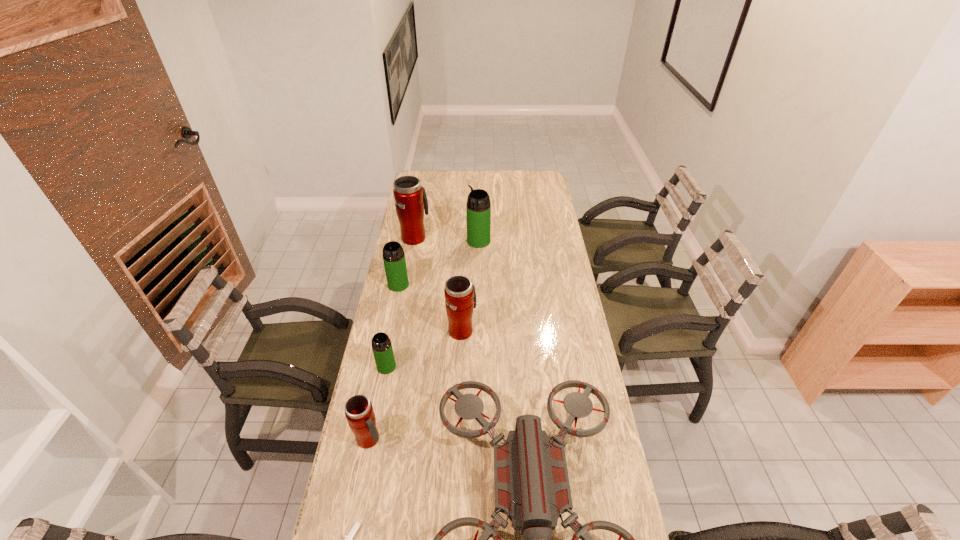
Where is `the farthest green thermos bottle`? the farthest green thermos bottle is located at coordinates (478, 208).

Find the location of a particular element. the rightmost green thermos bottle is located at coordinates (478, 208).

At what (x,y) coordinates should I click in order to perform the action: click on the biggest red thermos bottle. Please return your answer as a coordinate pair (x, y). This screenshot has width=960, height=540. Looking at the image, I should click on (410, 197).

This screenshot has width=960, height=540. I want to click on the second biggest green thermos bottle, so click(394, 260).

Locate an element on the screen. The width and height of the screenshot is (960, 540). the third farthest thermos bottle is located at coordinates (394, 260).

The height and width of the screenshot is (540, 960). I want to click on the rightmost red thermos bottle, so click(460, 296).

The height and width of the screenshot is (540, 960). I want to click on the second smallest red thermos bottle, so click(x=460, y=296).

Where is `the nearest green thermos bottle`? The width and height of the screenshot is (960, 540). the nearest green thermos bottle is located at coordinates (382, 349).

Locate an element on the screen. the second nearest thermos bottle is located at coordinates (382, 349).

You are a GUI agent. You are given a task and a screenshot of the screen. Output one action in this format:
    pyautogui.click(x=<x>, y=<y>)
    Task: Click on the smallest red thermos bottle
    
    Given the screenshot: What is the action you would take?
    pyautogui.click(x=359, y=412)